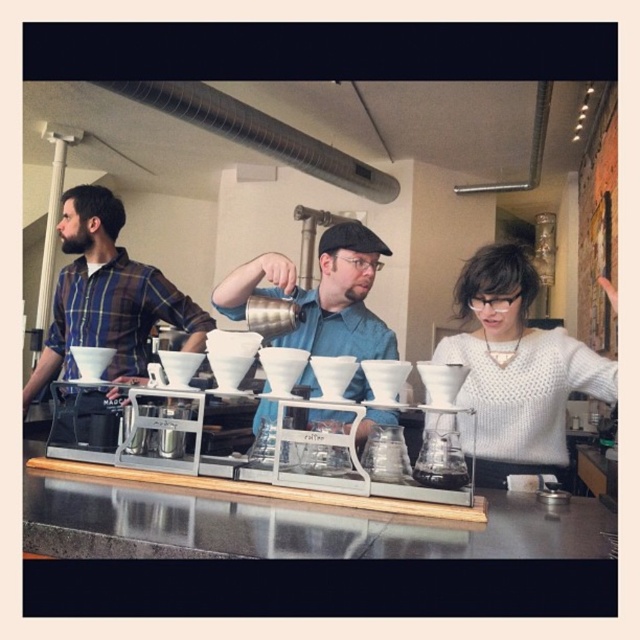
Based on the scene described, which individual is shorter in height between the person wearing the white knitted sweater at center and the one in the plaid flannel shirt at left?

The white knitted sweater at center is not as tall as the plaid flannel shirt at left, indicating that the person in the white knitted sweater at center is shorter.

You are a barista working in this coffee shop. You need to pour hot water from the matte silver kettle at center into the transparent glass carafe at center. Based on their positions, can you easily access both objects to perform this task?

The matte silver kettle at center is behind the transparent glass carafe at center, so you can easily access both objects by moving around the counter to reach the kettle first and then pour into the carafe.